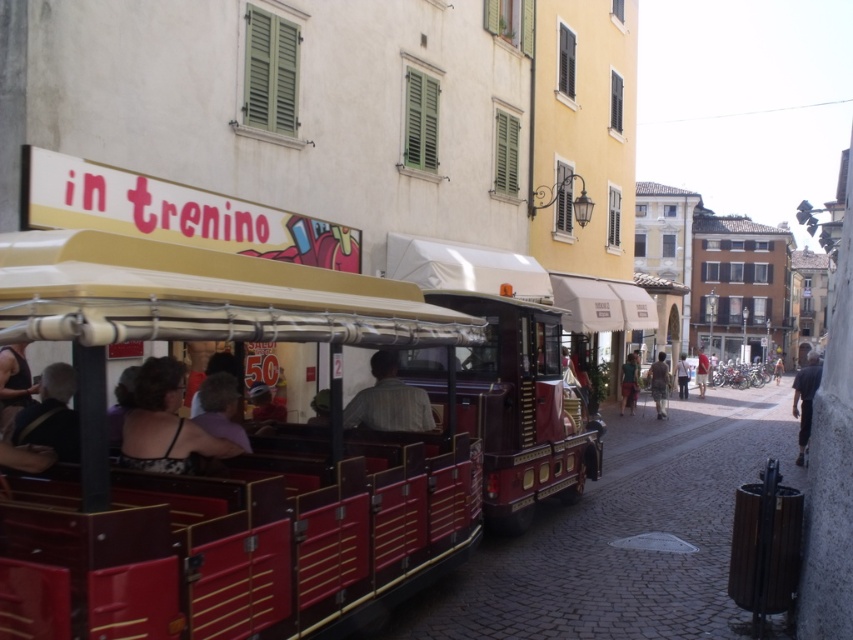
You are a tourist standing on the cobblestone street and want to take a photo of both the metallic red tram at center and the shiny red trolley at center. Can you fit both in your camera frame if your camera has a maximum field of view of 3 meters between the closest and farthest objects?

The distance between the metallic red tram at center and the shiny red trolley at center is 2.83 meters. Since your camera can capture up to 3 meters between objects, you can fit both in your camera frame.

You are standing at the intersection of the street and want to board the metallic red tram at center. According to the coordinates provided, is the tram positioned closer to the left or right side of the street?

The metallic red tram at center is located at point (215, 452). Since the coordinates are based on a system where (0, 0) is the bottom left corner and (852, 639) is the top right corner, the tram is closer to the right side of the street because the x coordinate 0.709 is closer to 1 than to 0.